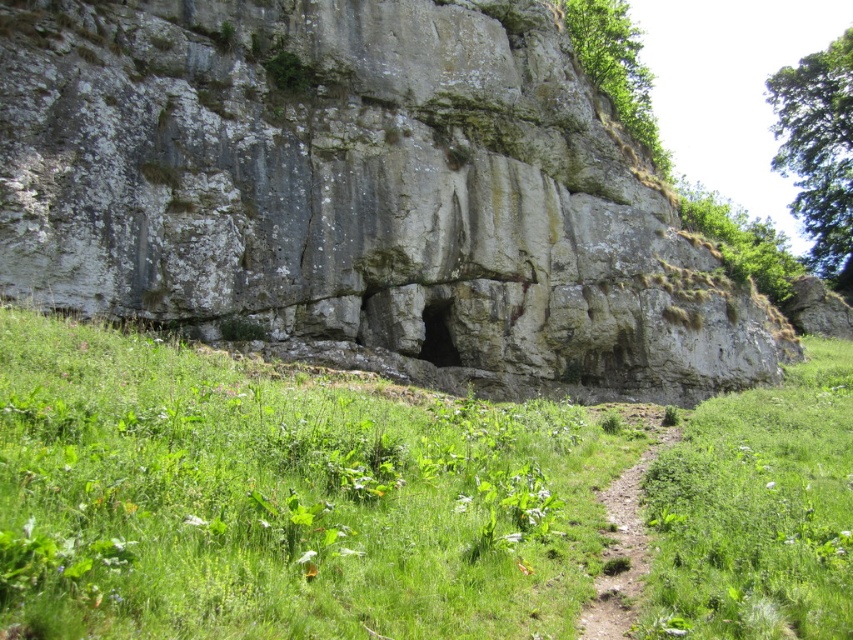
You are a hiker who wants to reach the gray stone cave at center. You are currently standing on the brown dirt path at center. Which direction should you move to approach the cave?

Since the brown dirt path at center is behind the gray stone cave at center, you should move forward from the path towards the cave to approach it.

You are an explorer trying to find shelter from an incoming storm. You see the gray stone cave at center and the smooth stone hole at center. Which one could provide more space to set up a tent?

The gray stone cave at center might be wider than smooth stone hole at center, so it could provide more space to set up a tent.

You are a hiker planning to explore the gray stone cave at center and the brown dirt path at center. Based on their positions, which one is higher up the cliff?

The gray stone cave at center is positioned over the brown dirt path at center, so it is higher up the cliff.